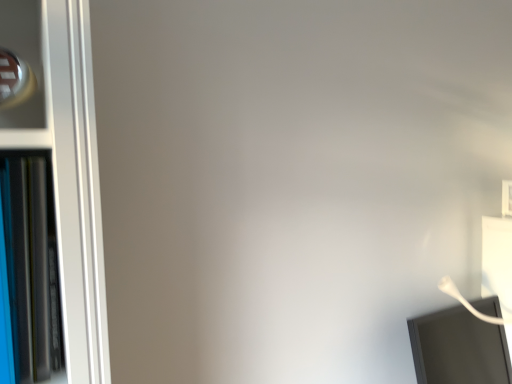
Question: Is blue glossy bookshelf at left to the right of white glossy computer monitor at lower right from the viewer's perspective?

Choices:
 (A) yes
 (B) no

Answer: (B)

Question: Is blue glossy bookshelf at left turned away from white glossy computer monitor at lower right?

Choices:
 (A) yes
 (B) no

Answer: (B)

Question: Is blue glossy bookshelf at left thinner than white glossy computer monitor at lower right?

Choices:
 (A) no
 (B) yes

Answer: (B)

Question: From a real-world perspective, does blue glossy bookshelf at left sit lower than white glossy computer monitor at lower right?

Choices:
 (A) no
 (B) yes

Answer: (A)

Question: Can you confirm if blue glossy bookshelf at left is shorter than white glossy computer monitor at lower right?

Choices:
 (A) no
 (B) yes

Answer: (A)

Question: Does blue glossy bookshelf at left turn towards white glossy computer monitor at lower right?

Choices:
 (A) no
 (B) yes

Answer: (A)

Question: From a real-world perspective, is white glossy computer monitor at lower right located higher than blue glossy bookshelf at left?

Choices:
 (A) no
 (B) yes

Answer: (A)

Question: From the image's perspective, would you say white glossy computer monitor at lower right is shown under blue glossy bookshelf at left?

Choices:
 (A) yes
 (B) no

Answer: (A)

Question: From the image's perspective, is white glossy computer monitor at lower right above blue glossy bookshelf at left?

Choices:
 (A) no
 (B) yes

Answer: (A)

Question: Does white glossy computer monitor at lower right have a lesser height compared to blue glossy bookshelf at left?

Choices:
 (A) no
 (B) yes

Answer: (B)

Question: From a real-world perspective, is white glossy computer monitor at lower right below blue glossy bookshelf at left?

Choices:
 (A) yes
 (B) no

Answer: (A)

Question: Is blue glossy bookshelf at left completely or partially inside white glossy computer monitor at lower right?

Choices:
 (A) yes
 (B) no

Answer: (B)

Question: Looking at their shapes, would you say white glossy computer monitor at lower right is wider or thinner than blue glossy bookshelf at left?

Choices:
 (A) thin
 (B) wide

Answer: (B)